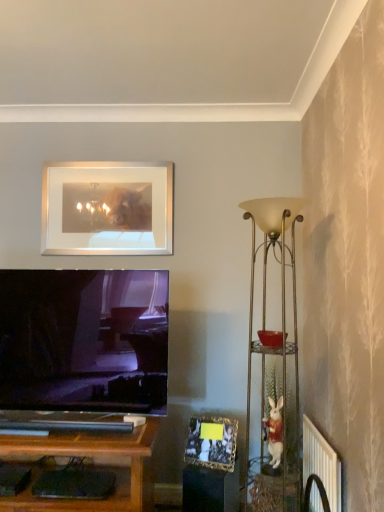
Question: Does silver/metallic picture frame at upper center, placed as the 1th picture frame when sorted from left to right, appear on the left side of white plastic radiator at lower right?

Choices:
 (A) yes
 (B) no

Answer: (A)

Question: From a real-world perspective, is silver/metallic picture frame at upper center, placed as the 1th picture frame when sorted from left to right, beneath white plastic radiator at lower right?

Choices:
 (A) no
 (B) yes

Answer: (A)

Question: Is silver/metallic picture frame at upper center, placed as the second picture frame when sorted from bottom to top, far from white plastic radiator at lower right?

Choices:
 (A) no
 (B) yes

Answer: (B)

Question: Does silver/metallic picture frame at upper center, which appears as the 1th picture frame when viewed from the back, have a lesser width compared to white plastic radiator at lower right?

Choices:
 (A) yes
 (B) no

Answer: (A)

Question: Considering the relative sizes of silver/metallic picture frame at upper center, placed as the second picture frame when sorted from bottom to top, and white plastic radiator at lower right in the image provided, is silver/metallic picture frame at upper center, placed as the second picture frame when sorted from bottom to top, bigger than white plastic radiator at lower right?

Choices:
 (A) no
 (B) yes

Answer: (B)

Question: Can you confirm if silver/metallic picture frame at upper center, the second picture frame positioned from the front, is shorter than white plastic radiator at lower right?

Choices:
 (A) yes
 (B) no

Answer: (B)

Question: From a real-world perspective, is silver/metallic picture frame at upper center, which is the 1th picture frame in top-to-bottom order, under metallic gold floor lamp at right?

Choices:
 (A) yes
 (B) no

Answer: (B)

Question: Is silver/metallic picture frame at upper center, the second picture frame positioned from the front, at the right side of metallic gold floor lamp at right?

Choices:
 (A) no
 (B) yes

Answer: (A)

Question: Could metallic gold floor lamp at right be considered to be inside silver/metallic picture frame at upper center, placed as the second picture frame when sorted from bottom to top?

Choices:
 (A) yes
 (B) no

Answer: (B)

Question: Is silver/metallic picture frame at upper center, which is the 2th picture frame from right to left, further to camera compared to metallic gold floor lamp at right?

Choices:
 (A) yes
 (B) no

Answer: (A)

Question: Considering the relative sizes of silver/metallic picture frame at upper center, the second picture frame positioned from the front, and metallic gold floor lamp at right in the image provided, is silver/metallic picture frame at upper center, the second picture frame positioned from the front, wider than metallic gold floor lamp at right?

Choices:
 (A) yes
 (B) no

Answer: (B)

Question: From a real-world perspective, is silver/metallic picture frame at upper center, which is the 1th picture frame in top-to-bottom order, located higher than metallic gold floor lamp at right?

Choices:
 (A) no
 (B) yes

Answer: (B)

Question: From a real-world perspective, is gold metallic photo frame at lower center, placed as the first picture frame when sorted from bottom to top, under white plastic radiator at lower right?

Choices:
 (A) yes
 (B) no

Answer: (B)